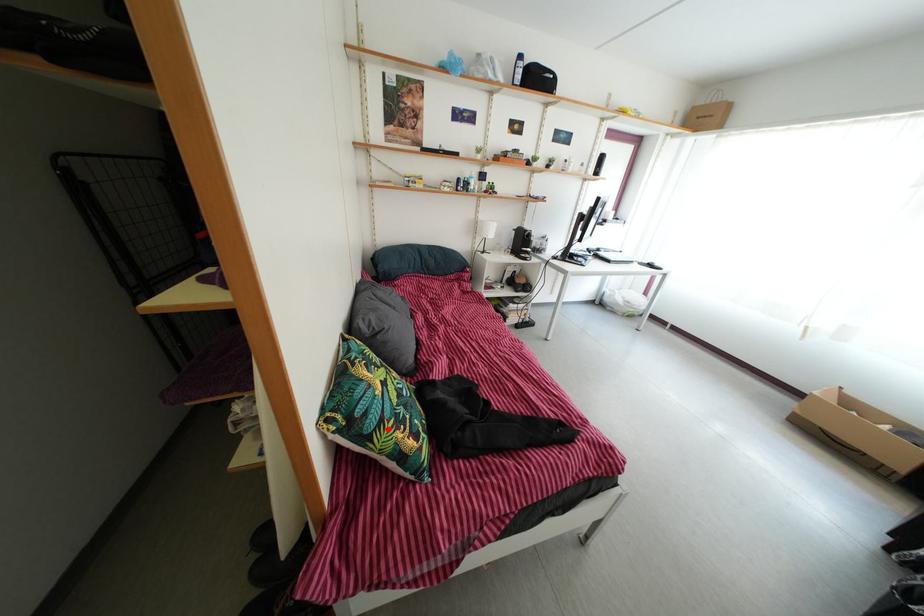
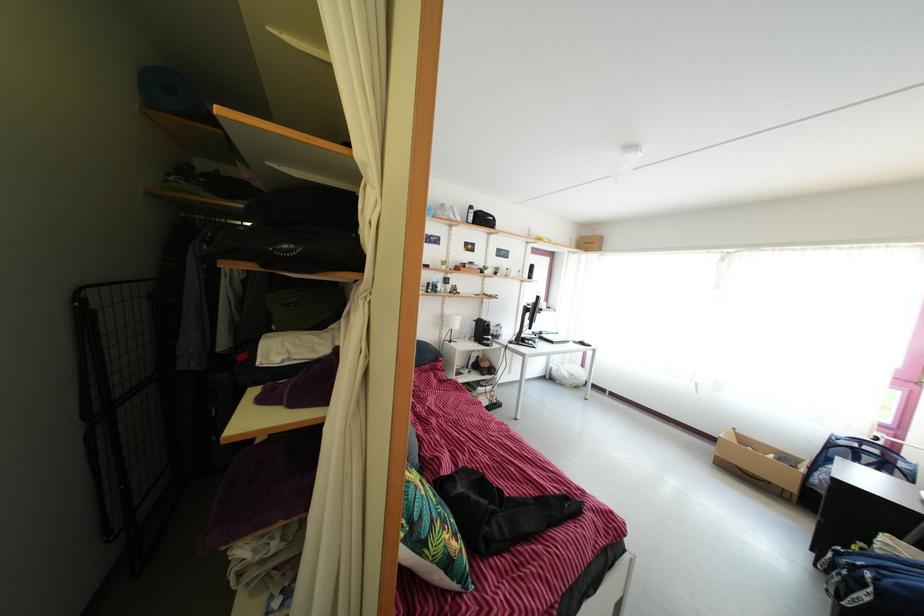
Locate, in the second image, the point that corresponds to the highlighted location in the first image.

(439, 531)